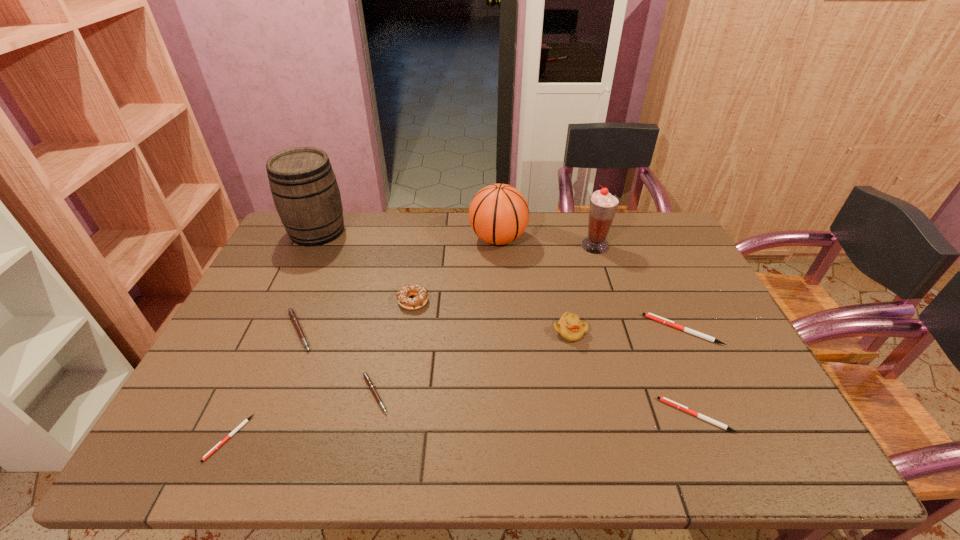
At what (x,y) coordinates should I click in order to perform the action: click on the tallest object. Please return your answer as a coordinate pair (x, y). This screenshot has width=960, height=540. Looking at the image, I should click on (304, 188).

Identify the location of red smoothie. The height and width of the screenshot is (540, 960). (603, 205).

At what (x,y) coordinates should I click in order to perform the action: click on the sixth object from left to right. Please return your answer as a coordinate pair (x, y). Looking at the image, I should click on (498, 214).

Find the location of a particular element. The height and width of the screenshot is (540, 960). orange basketball is located at coordinates (498, 214).

The width and height of the screenshot is (960, 540). I want to click on duckling, so click(569, 326).

In order to click on the seventh object from left to right in this screenshot , I will do `click(569, 326)`.

The image size is (960, 540). What are the coordinates of `the fifth tallest object` in the screenshot? It's located at (420, 292).

Locate an element on the screen. This screenshot has height=540, width=960. chocolate doughnut is located at coordinates (420, 292).

In order to click on the left pink pen in this screenshot , I will do `click(293, 316)`.

Where is `the bigger pink pen`? The width and height of the screenshot is (960, 540). the bigger pink pen is located at coordinates (293, 316).